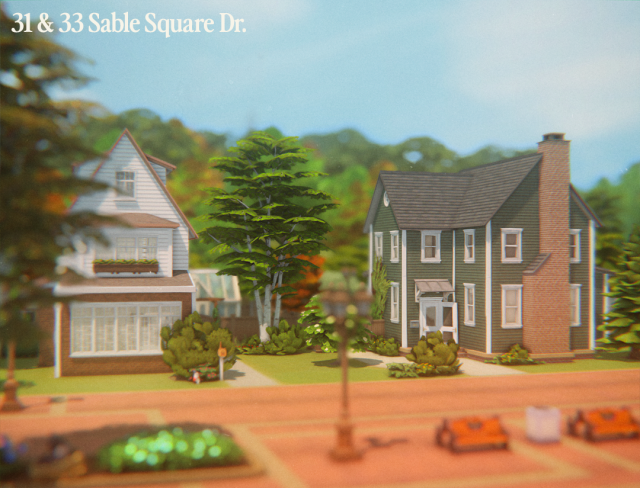
What are the coordinates of `third floor window` in the screenshot? It's located at (388, 201), (129, 185).